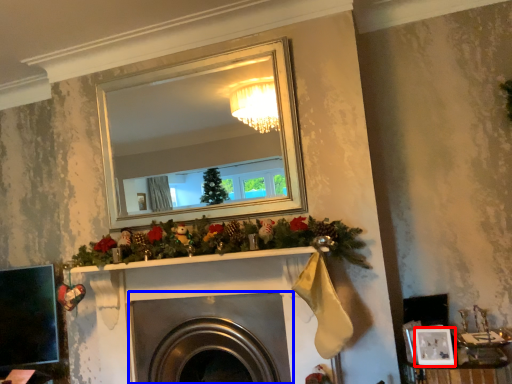
Question: Which object appears closest to the camera in this image, picture frame (highlighted by a red box) or fireplace (highlighted by a blue box)?

Choices:
 (A) picture frame
 (B) fireplace

Answer: (A)